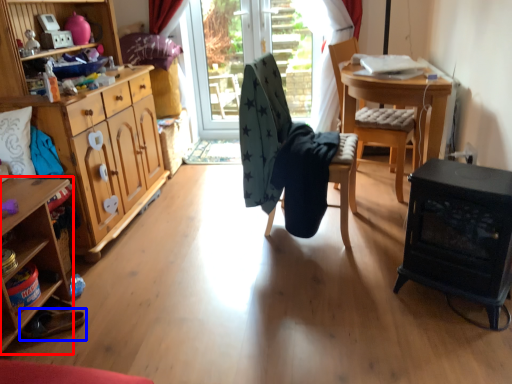
Question: Among these objects, which one is nearest to the camera, desk (highlighted by a red box) or footwear (highlighted by a blue box)?

Choices:
 (A) desk
 (B) footwear

Answer: (A)